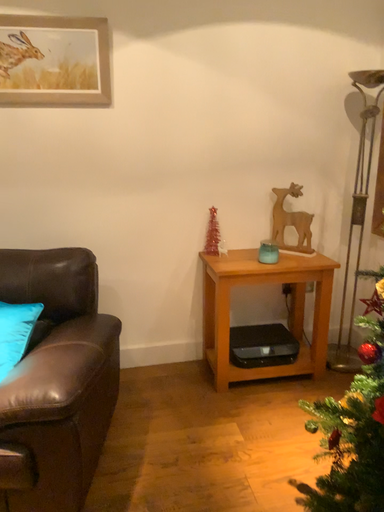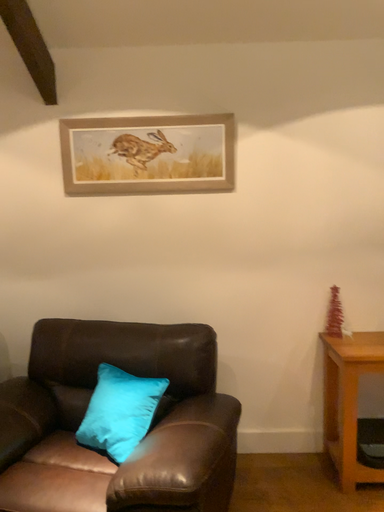
Question: How did the camera likely rotate when shooting the video?

Choices:
 (A) rotated upward
 (B) rotated downward

Answer: (A)